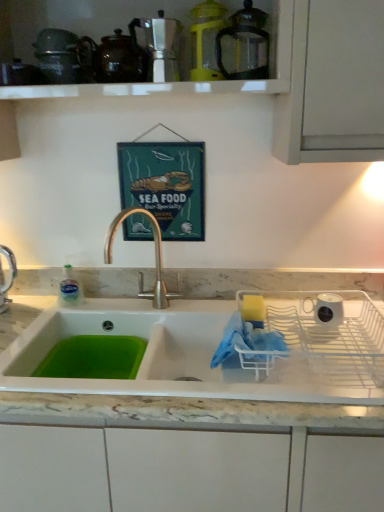
Question: Is brown glossy teapot at upper center to the left of metallic silver coffee maker at upper center, acting as the fourth appliance starting from the right, from the viewer's perspective?

Choices:
 (A) no
 (B) yes

Answer: (B)

Question: Considering the relative sizes of brown glossy teapot at upper center and metallic silver coffee maker at upper center, arranged as the third appliance when viewed from the top, in the image provided, is brown glossy teapot at upper center thinner than metallic silver coffee maker at upper center, arranged as the third appliance when viewed from the top,?

Choices:
 (A) yes
 (B) no

Answer: (B)

Question: Is brown glossy teapot at upper center taller than metallic silver coffee maker at upper center, arranged as the third appliance when viewed from the top?

Choices:
 (A) yes
 (B) no

Answer: (B)

Question: Could you tell me if brown glossy teapot at upper center is turned towards metallic silver coffee maker at upper center, placed as the second appliance when sorted from bottom to top?

Choices:
 (A) no
 (B) yes

Answer: (A)

Question: Is brown glossy teapot at upper center bigger than metallic silver coffee maker at upper center, arranged as the third appliance when viewed from the top?

Choices:
 (A) no
 (B) yes

Answer: (B)

Question: Is brown glossy teapot at upper center closer to camera compared to metallic silver coffee maker at upper center, which ranks as the first appliance in left-to-right order?

Choices:
 (A) yes
 (B) no

Answer: (B)

Question: Does yellow plastic blender at upper center, acting as the 4th appliance starting from the bottom, appear on the left side of white ceramic mug at right, the first appliance from the right?

Choices:
 (A) yes
 (B) no

Answer: (A)

Question: Is the depth of yellow plastic blender at upper center, acting as the 4th appliance starting from the bottom, greater than that of white ceramic mug at right, the 4th appliance in the left-to-right sequence?

Choices:
 (A) no
 (B) yes

Answer: (A)

Question: From the image's perspective, is yellow plastic blender at upper center, which is the third appliance in right-to-left order, above white ceramic mug at right, the 4th appliance in the left-to-right sequence?

Choices:
 (A) yes
 (B) no

Answer: (A)

Question: Can you confirm if yellow plastic blender at upper center, acting as the 4th appliance starting from the bottom, is positioned to the right of white ceramic mug at right, the 1th appliance ordered from the bottom?

Choices:
 (A) yes
 (B) no

Answer: (B)

Question: Is yellow plastic blender at upper center, acting as the 2th appliance starting from the left, aimed at white ceramic mug at right, the 4th appliance in the left-to-right sequence?

Choices:
 (A) yes
 (B) no

Answer: (B)

Question: Is yellow plastic blender at upper center, acting as the 4th appliance starting from the bottom, not within white ceramic mug at right, the fourth appliance viewed from the top?

Choices:
 (A) yes
 (B) no

Answer: (A)

Question: Considering the relative positions of white ceramic sink at center and white ceramic mug at right, the 4th appliance in the left-to-right sequence, in the image provided, is white ceramic sink at center to the left of white ceramic mug at right, the 4th appliance in the left-to-right sequence, from the viewer's perspective?

Choices:
 (A) no
 (B) yes

Answer: (B)